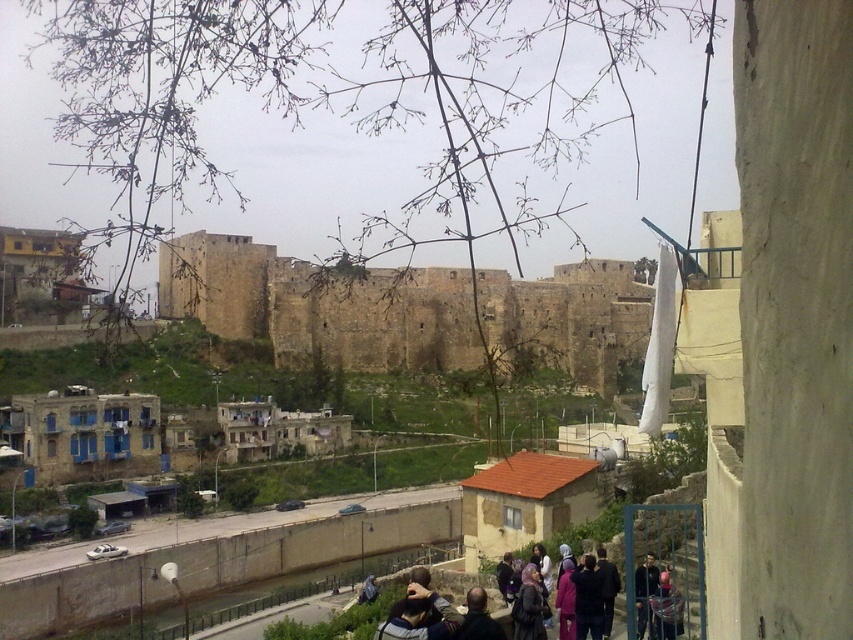
Question: Does brown stone fort at center appear on the left side of dark blue jacket at lower right?

Choices:
 (A) yes
 (B) no

Answer: (A)

Question: Can you confirm if brown stone fort at center is thinner than dark blue jacket at lower right?

Choices:
 (A) no
 (B) yes

Answer: (A)

Question: Does brown stone fort at center appear on the left side of dark blue jacket at lower right?

Choices:
 (A) no
 (B) yes

Answer: (B)